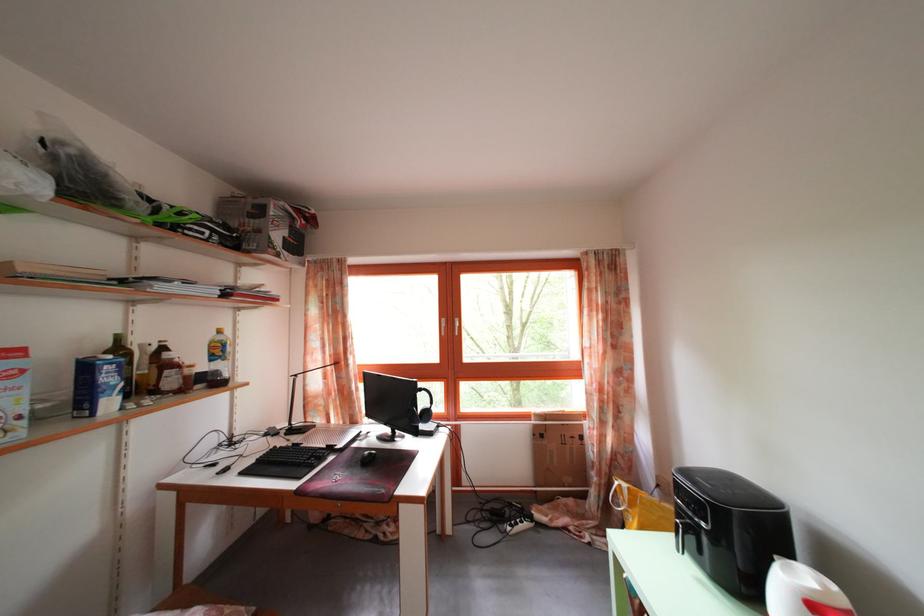
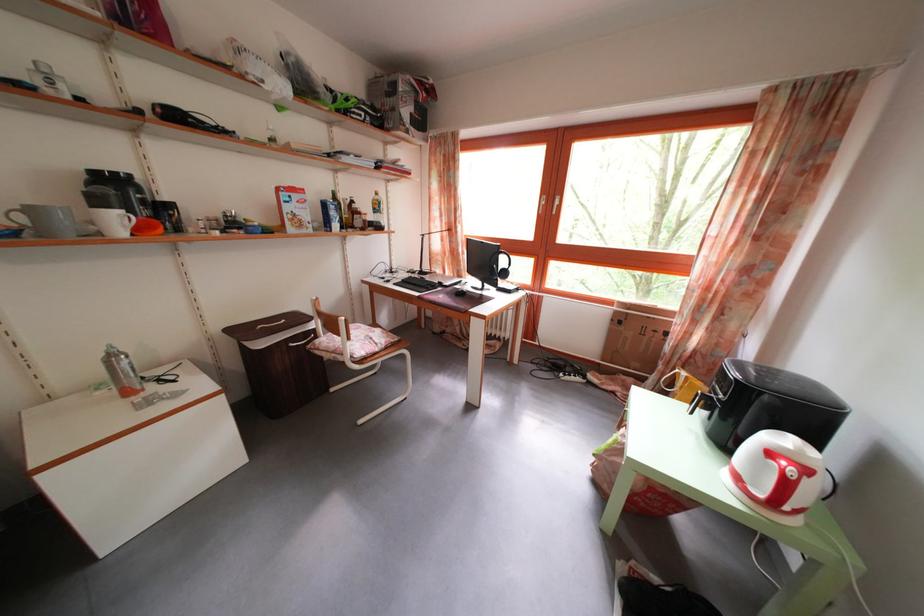
Locate, in the second image, the point that corresponds to the point at 631,492 in the first image.

(691, 381)